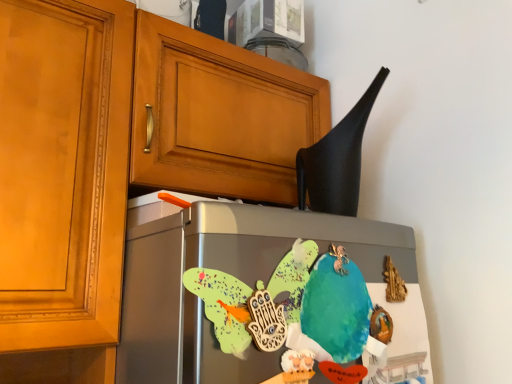
Question: Considering the relative sizes of matte wood cabinet at upper left and watercolor paper parrot at center in the image provided, is matte wood cabinet at upper left bigger than watercolor paper parrot at center?

Choices:
 (A) no
 (B) yes

Answer: (B)

Question: Is matte wood cabinet at upper left at the right side of watercolor paper parrot at center?

Choices:
 (A) no
 (B) yes

Answer: (A)

Question: Does matte wood cabinet at upper left contain watercolor paper parrot at center?

Choices:
 (A) yes
 (B) no

Answer: (B)

Question: From the image's perspective, would you say matte wood cabinet at upper left is shown under watercolor paper parrot at center?

Choices:
 (A) no
 (B) yes

Answer: (A)

Question: From a real-world perspective, is matte wood cabinet at upper left physically above watercolor paper parrot at center?

Choices:
 (A) yes
 (B) no

Answer: (A)

Question: Could you tell me if matte wood cabinet at upper left is facing watercolor paper parrot at center?

Choices:
 (A) yes
 (B) no

Answer: (A)

Question: Is matte wood cabinet at upper left located within satin silver fridge at center?

Choices:
 (A) no
 (B) yes

Answer: (A)

Question: Can you confirm if satin silver fridge at center is bigger than matte wood cabinet at upper left?

Choices:
 (A) yes
 (B) no

Answer: (B)

Question: Is satin silver fridge at center positioned behind matte wood cabinet at upper left?

Choices:
 (A) no
 (B) yes

Answer: (A)

Question: From a real-world perspective, does satin silver fridge at center stand above matte wood cabinet at upper left?

Choices:
 (A) yes
 (B) no

Answer: (B)

Question: Considering the relative sizes of satin silver fridge at center and matte wood cabinet at upper left in the image provided, is satin silver fridge at center taller than matte wood cabinet at upper left?

Choices:
 (A) no
 (B) yes

Answer: (A)

Question: Is satin silver fridge at center positioned with its back to matte wood cabinet at upper left?

Choices:
 (A) no
 (B) yes

Answer: (B)

Question: Is watercolor paper parrot at center smaller than black matte exhaust hood at upper right?

Choices:
 (A) yes
 (B) no

Answer: (A)